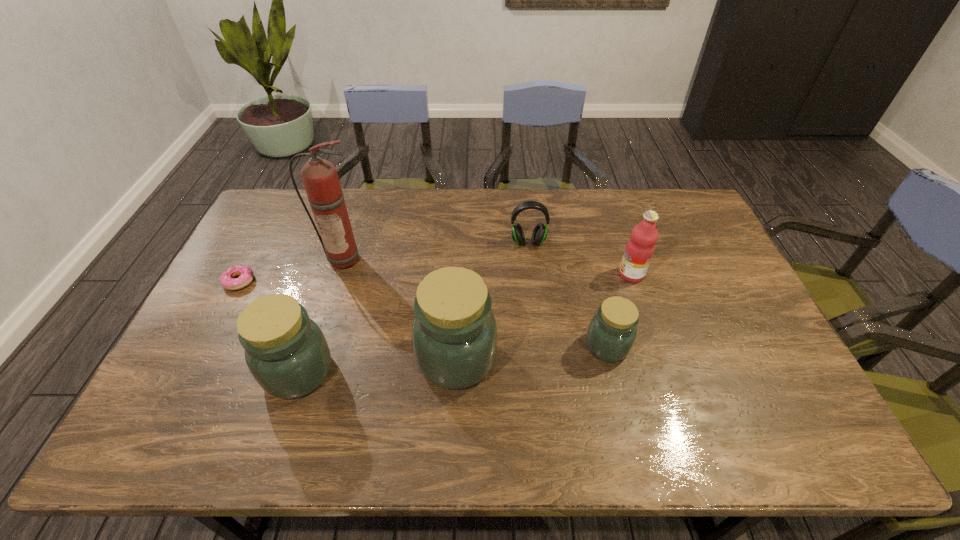
In order to click on free space at the near edge of the desktop in this screenshot , I will do `click(616, 397)`.

Where is `vacant space at the left edge of the desktop`? vacant space at the left edge of the desktop is located at coordinates (218, 298).

The image size is (960, 540). I want to click on vacant space at the right edge of the desktop, so click(x=738, y=363).

Identify the location of vacant region at the far right corner. (665, 193).

Locate an element on the screen. empty space that is in between the rightmost object and the headset is located at coordinates (580, 258).

Locate an element on the screen. This screenshot has width=960, height=540. vacant space in between the second tallest jar and the headset is located at coordinates (413, 307).

Where is `free spot between the leftmost object and the third object from right to left`? free spot between the leftmost object and the third object from right to left is located at coordinates (384, 262).

You are a GUI agent. You are given a task and a screenshot of the screen. Output one action in this format:
    pyautogui.click(x=<x>, y=<y>)
    Task: Click on the blank region between the leftmost jar and the second jar from left to right
    The width and height of the screenshot is (960, 540).
    Given the screenshot: What is the action you would take?
    pyautogui.click(x=377, y=365)

In order to click on free space between the headset and the leftmost jar in this screenshot , I will do `click(413, 307)`.

Find the location of `free space between the doughnut and the fire extinguisher`. free space between the doughnut and the fire extinguisher is located at coordinates (292, 269).